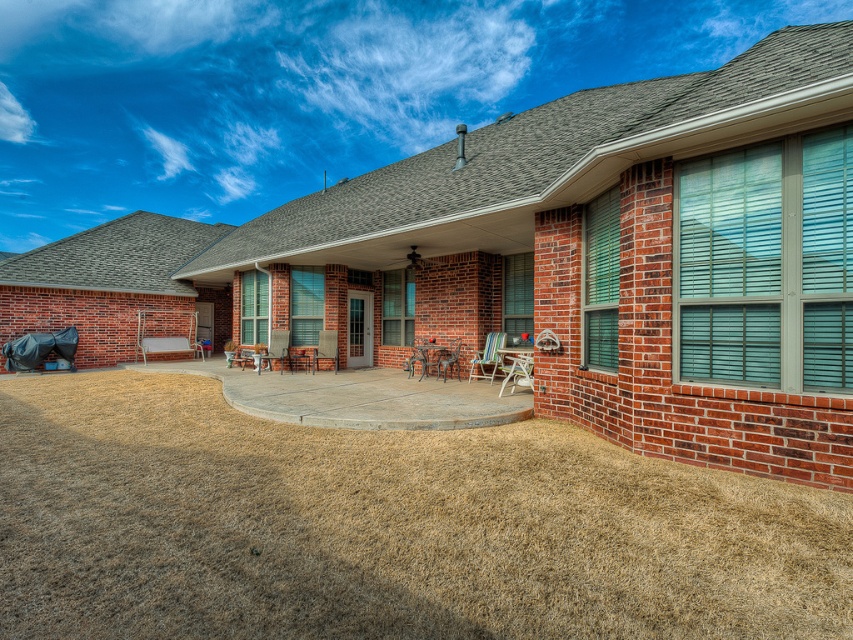
Which of these two, metallic silver chair at center or metallic brown chair at center, stands taller?

Standing taller between the two is metallic brown chair at center.

Which is more to the right, metallic silver chair at center or metallic brown chair at center?

metallic silver chair at center

Is point (527, 362) closer to camera compared to point (445, 362)?

Yes, it is.

The height and width of the screenshot is (640, 853). I want to click on metallic silver chair at center, so click(517, 371).

Which is behind, point (486, 353) or point (457, 353)?

The point (457, 353) is more distant.

Does multicolored plastic chair at center lie behind metallic brown chair at center?

No.

Where is `multicolored plastic chair at center`? This screenshot has width=853, height=640. multicolored plastic chair at center is located at coordinates (486, 356).

Where is `multicolored plastic chair at center`? The image size is (853, 640). multicolored plastic chair at center is located at coordinates (486, 356).

Who is taller, brown brick patio at center or brown grass at lower left?

Standing taller between the two is brown brick patio at center.

Who is more forward, (459, 252) or (286, 596)?

Positioned in front is point (286, 596).

Who is more distant from viewer, (775, 404) or (218, 483)?

The point (218, 483) is behind.

Image resolution: width=853 pixels, height=640 pixels. Identify the location of brown brick patio at center. (550, 260).